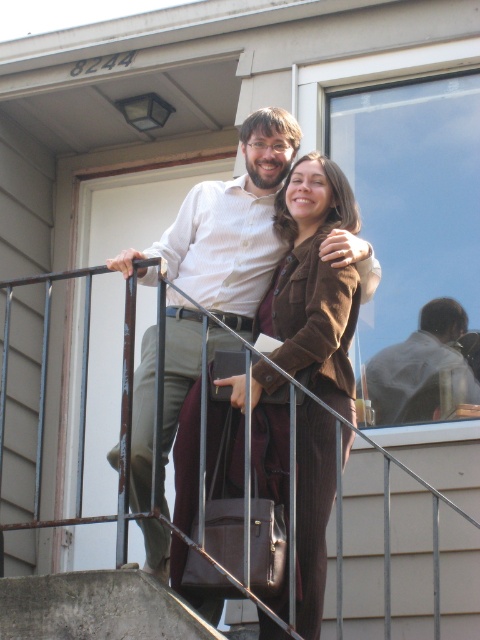
Based on the photo, is metallic gray railing at upper center smaller than light brown leather jacket at upper right?

No.

Identify the location of metallic gray railing at upper center. The height and width of the screenshot is (640, 480). (410, 531).

Is metallic gray railing at upper center in front of brown woolen suit at center?

That is True.

Who is higher up, metallic gray railing at upper center or brown woolen suit at center?

brown woolen suit at center

Does point (358, 611) lie behind point (312, 160)?

That is False.

Identify the location of metallic gray railing at upper center. (410, 531).

Measure the distance between brown woolen suit at center and camera.

brown woolen suit at center and camera are 99.44 feet apart from each other.

Between brown woolen suit at center and light brown leather jacket at upper right, which one has less height?

Standing shorter between the two is light brown leather jacket at upper right.

The width and height of the screenshot is (480, 640). What are the coordinates of `brown woolen suit at center` in the screenshot? It's located at (313, 282).